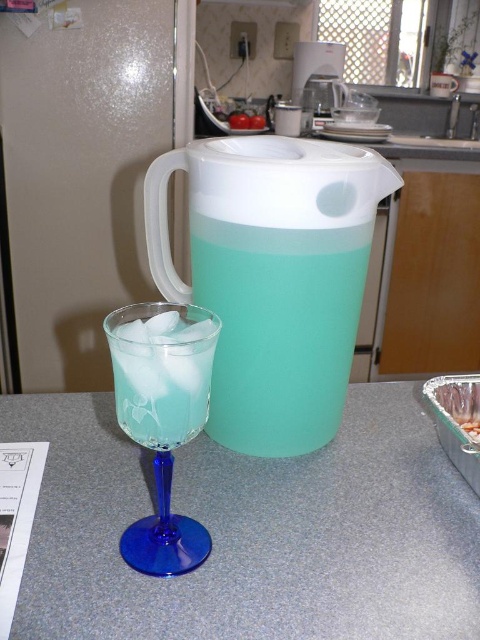
Question: Which point is closer to the camera?

Choices:
 (A) blue glass at left
 (B) translucent plastic pitcher at center
 (C) white plastic blender at upper center

Answer: (A)

Question: Is translucent plastic pitcher at center wider than transparent glass at left?

Choices:
 (A) yes
 (B) no

Answer: (A)

Question: Among these objects, which one is nearest to the camera?

Choices:
 (A) translucent plastic food at lower right
 (B) translucent plastic pitcher at center
 (C) blue glass at left

Answer: (C)

Question: Can you confirm if translucent plastic pitcher at center is bigger than translucent plastic food at lower right?

Choices:
 (A) no
 (B) yes

Answer: (B)

Question: Which is nearer to the translucent plastic food at lower right?

Choices:
 (A) white plastic blender at upper center
 (B) transparent glass at left
 (C) translucent plastic pitcher at center

Answer: (C)

Question: Does matte plastic counter top at center have a greater width compared to white plastic blender at upper center?

Choices:
 (A) no
 (B) yes

Answer: (B)